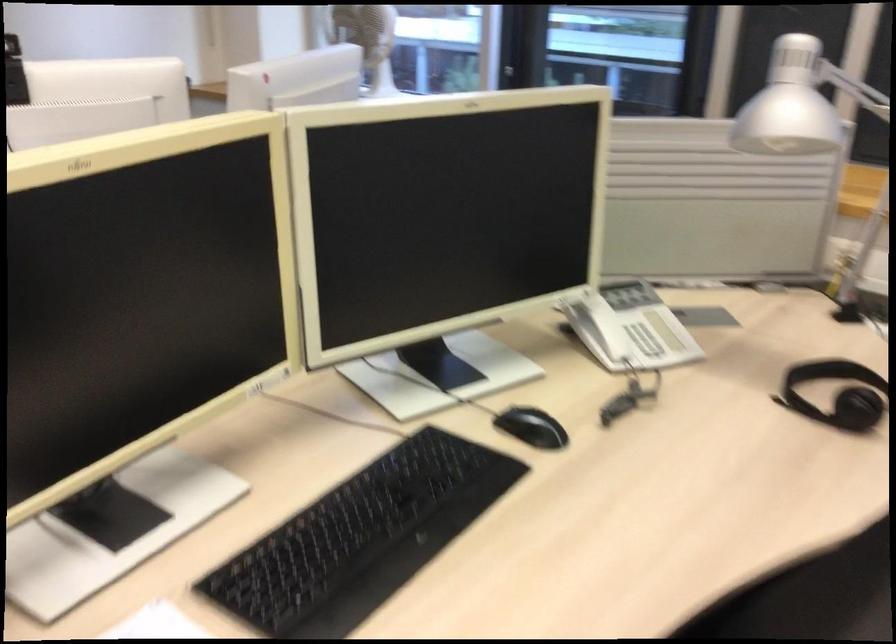
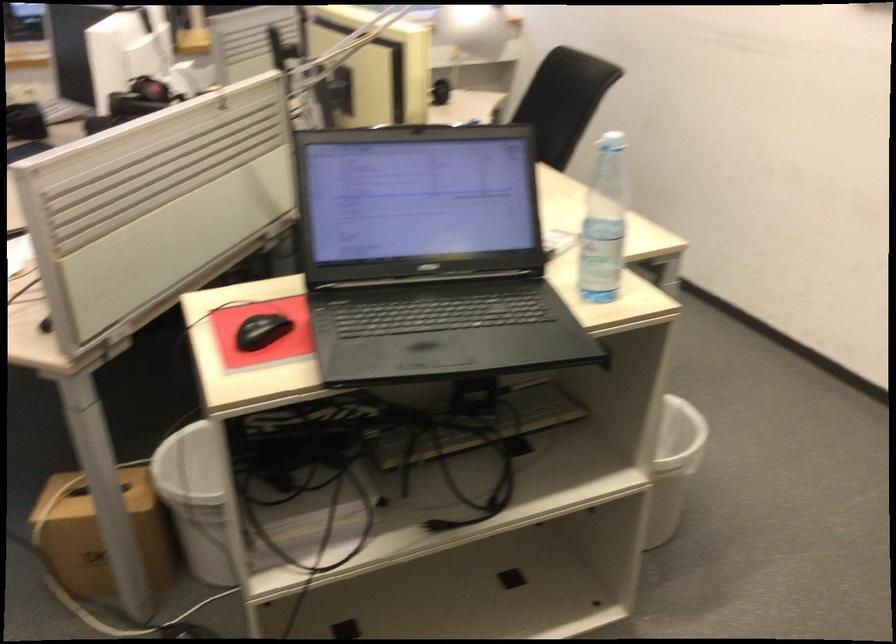
Question: I am providing you with two images of the same scene from different viewpoints. Please identify which objects are invisible in image2.

Choices:
 (A) black keyboard
 (B) white bottle cap
 (C) orange and blue magazine
 (D) black computer mouse

Answer: (A)